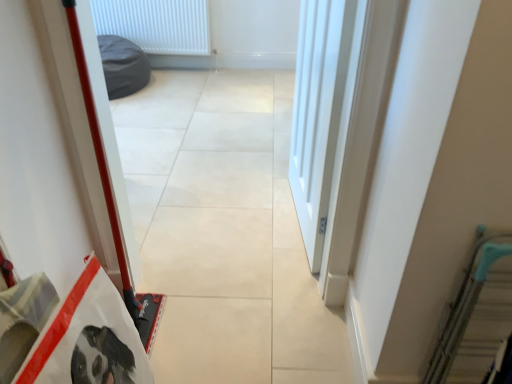
Describe the element at coordinates (321, 109) in the screenshot. I see `white smooth door at center` at that location.

Measure the distance between teal metallic escalator at right and camera.

teal metallic escalator at right is 36.08 inches away from camera.

Locate an element on the screen. teal metallic escalator at right is located at coordinates (476, 314).

Locate an element on the screen. The height and width of the screenshot is (384, 512). white smooth door at center is located at coordinates 321,109.

From the image's perspective, which is below, white smooth door at center or teal metallic escalator at right?

teal metallic escalator at right, from the image's perspective.

Which is in front, point (293, 153) or point (511, 256)?

The point (511, 256) is closer to the camera.

How different are the orientations of white smooth door at center and teal metallic escalator at right in degrees?

The angle between the facing direction of white smooth door at center and the facing direction of teal metallic escalator at right is 82.9 degrees.

Who is bigger, white smooth door at center or teal metallic escalator at right?

white smooth door at center.

Is teal metallic escalator at right with beige tile floor at center?

teal metallic escalator at right and beige tile floor at center are clearly separated.

In the scene shown: From a real-world perspective, which object rests below the other?

teal metallic escalator at right, from a real-world perspective.

Measure the distance from teal metallic escalator at right to beige tile floor at center.

teal metallic escalator at right and beige tile floor at center are 1.02 meters apart from each other.

Is teal metallic escalator at right inside the boundaries of beige tile floor at center, or outside?

teal metallic escalator at right is not enclosed by beige tile floor at center.

Based on the photo, between beige tile floor at center and white smooth door at center, which one appears on the right side from the viewer's perspective?

From the viewer's perspective, white smooth door at center appears more on the right side.

From a real-world perspective, which object rests below the other?

In real-world perspective, white smooth door at center is lower.

Is beige tile floor at center aimed at white smooth door at center?

No.

Considering the relative sizes of beige tile floor at center and white smooth door at center in the image provided, is beige tile floor at center wider than white smooth door at center?

Yes, beige tile floor at center is wider than white smooth door at center.

In the scene shown: From the image's perspective, who appears lower, teal metallic escalator at right or white smooth door at center?

teal metallic escalator at right appears lower in the image.

Which is more to the left, teal metallic escalator at right or white smooth door at center?

Positioned to the left is white smooth door at center.

Between teal metallic escalator at right and white smooth door at center, which one is positioned behind?

white smooth door at center is further away from the camera.

Is teal metallic escalator at right in contact with white smooth door at center?

No, teal metallic escalator at right is not next to white smooth door at center.

Considering the relative sizes of white smooth door at center and beige tile floor at center in the image provided, is white smooth door at center taller than beige tile floor at center?

No, white smooth door at center is not taller than beige tile floor at center.

Does point (294, 117) appear closer or farther from the camera than point (273, 109)?

Point (294, 117) is positioned closer to the camera compared to point (273, 109).

Is white smooth door at center next to beige tile floor at center?

No.

Looking at this image, is beige tile floor at center far away from white plastic radiator at upper center?

Yes, beige tile floor at center is far from white plastic radiator at upper center.

From a real-world perspective, is beige tile floor at center physically located above or below white plastic radiator at upper center?

From a real-world perspective, beige tile floor at center is physically above white plastic radiator at upper center.

Is beige tile floor at center facing towards white plastic radiator at upper center?

No, beige tile floor at center is not aimed at white plastic radiator at upper center.

From the image's perspective, which is below, beige tile floor at center or white plastic radiator at upper center?

beige tile floor at center appears lower in the image.

Between teal metallic escalator at right and white plastic radiator at upper center, which one has less height?

With less height is white plastic radiator at upper center.

How many degrees apart are the facing directions of teal metallic escalator at right and white plastic radiator at upper center?

0.37 degrees separate the facing orientations of teal metallic escalator at right and white plastic radiator at upper center.

From a real-world perspective, is teal metallic escalator at right under white plastic radiator at upper center?

No.

Which is closer to the camera, [486,250] or [141,11]?

Point [486,250] is closer to the camera than point [141,11].

Where is `escalator in front of the white smooth door at center`? This screenshot has height=384, width=512. escalator in front of the white smooth door at center is located at coordinates (476, 314).

Identify the location of concrete above the teal metallic escalator at right (from the image's perspective). This screenshot has width=512, height=384. pos(225,231).

From the image, which object appears to be nearer to beige tile floor at center, white plastic radiator at upper center or white smooth door at center?

white smooth door at center.

Considering their positions, is teal metallic escalator at right positioned closer to beige tile floor at center than white plastic radiator at upper center?

The object closer to beige tile floor at center is teal metallic escalator at right.

Estimate the real-world distances between objects in this image. Which object is closer to white plastic radiator at upper center, beige tile floor at center or white smooth door at center?

Based on the image, beige tile floor at center appears to be nearer to white plastic radiator at upper center.

Estimate the real-world distances between objects in this image. Which object is closer to teal metallic escalator at right, beige tile floor at center or white plastic radiator at upper center?

beige tile floor at center is positioned closer to the anchor teal metallic escalator at right.

Considering their positions, is teal metallic escalator at right positioned closer to white smooth door at center than white plastic radiator at upper center?

The object closer to white smooth door at center is teal metallic escalator at right.

Based on their spatial positions, is beige tile floor at center or white smooth door at center further from teal metallic escalator at right?

Based on the image, beige tile floor at center appears to be further to teal metallic escalator at right.

Looking at the image, which one is located closer to white plastic radiator at upper center, beige tile floor at center or teal metallic escalator at right?

beige tile floor at center is closer to white plastic radiator at upper center.

Looking at the image, which one is located closer to teal metallic escalator at right, white plastic radiator at upper center or white smooth door at center?

Based on the image, white smooth door at center appears to be nearer to teal metallic escalator at right.

Locate an element on the screen. concrete between teal metallic escalator at right and white plastic radiator at upper center in the front-back direction is located at coordinates (225, 231).

Where is `door between teal metallic escalator at right and white plastic radiator at upper center in the front-back direction`? This screenshot has height=384, width=512. door between teal metallic escalator at right and white plastic radiator at upper center in the front-back direction is located at coordinates (321, 109).

The height and width of the screenshot is (384, 512). Identify the location of door positioned between beige tile floor at center and white plastic radiator at upper center from near to far. (321, 109).

The width and height of the screenshot is (512, 384). What are the coordinates of `door between beige tile floor at center and teal metallic escalator at right in the horizontal direction` in the screenshot? It's located at (321, 109).